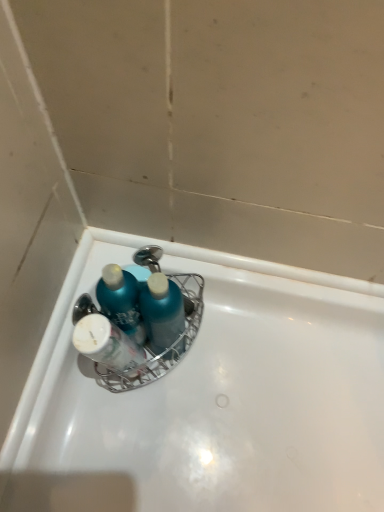
You are a GUI agent. You are given a task and a screenshot of the screen. Output one action in this format:
    pyautogui.click(x=<x>, y=<y>)
    Task: Click on the free space that is to the left of white glossy bottle at center
    The image size is (384, 512).
    Given the screenshot: What is the action you would take?
    pyautogui.click(x=71, y=387)